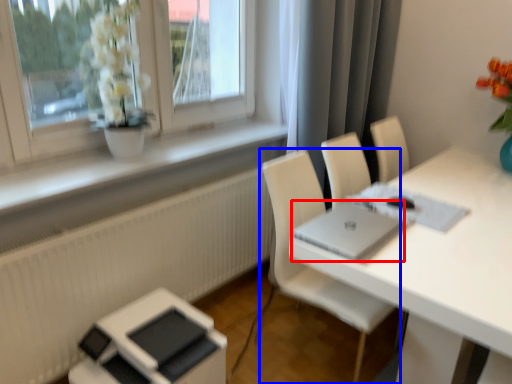
Question: Which object is closer to the camera taking this photo, laptop (highlighted by a red box) or chair (highlighted by a blue box)?

Choices:
 (A) laptop
 (B) chair

Answer: (A)